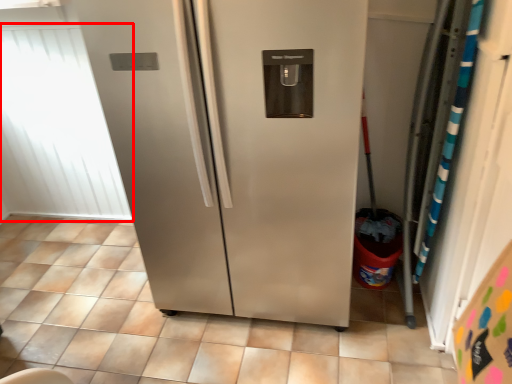
Question: From the image, what is the correct spatial relationship of window screen (annotated by the red box) in relation to tile?

Choices:
 (A) left
 (B) right

Answer: (A)